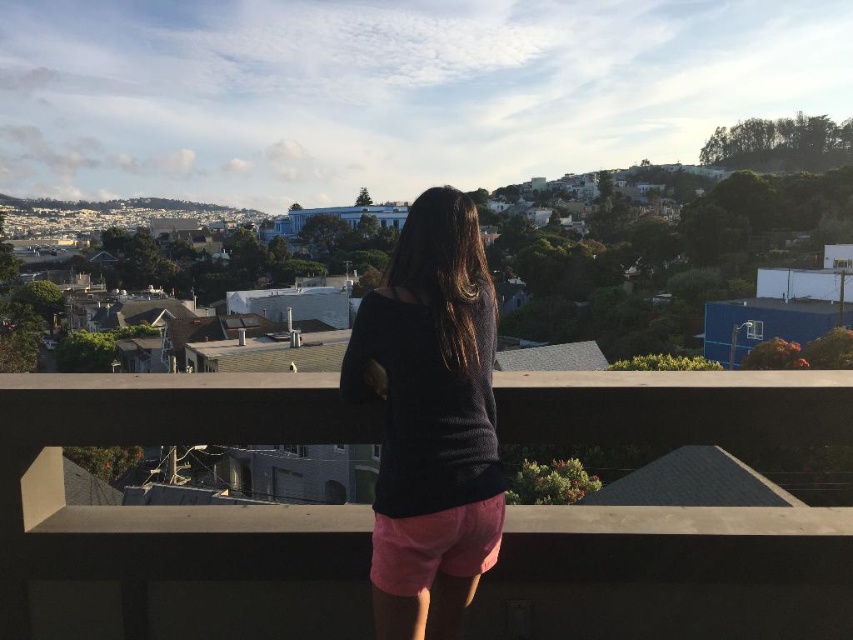
You are standing on the balcony and want to place a 10 feet long ladder between the concrete at center and the dark gray sweater at center. Is there enough space?

The distance between the concrete at center and the dark gray sweater at center is 12.60 feet, which is more than the 10 feet length of the ladder. Therefore, there is enough space to place the ladder between them.

You are standing on a balcony and see the concrete at center and the dark gray sweater at center. Which object is positioned to the left from your viewpoint?

The concrete at center is to the left of the dark gray sweater at center from your viewpoint.